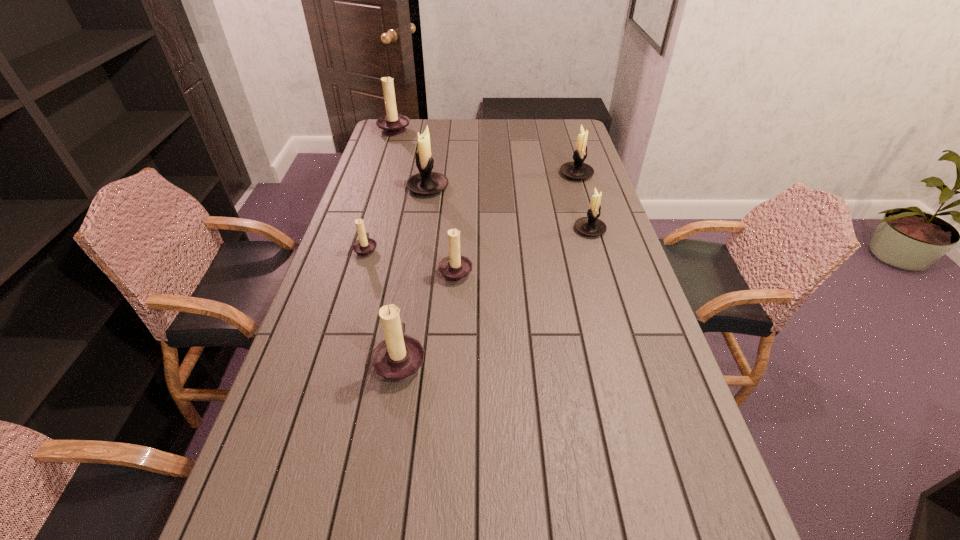
The image size is (960, 540). Find the location of `the biggest brown candle holder`. the biggest brown candle holder is located at coordinates click(393, 124).

Identify the location of the farthest brown candle holder. The width and height of the screenshot is (960, 540). (393, 124).

At what (x,y) coordinates should I click in order to perform the action: click on the biggest white candle holder. Please return your answer as a coordinate pair (x, y). This screenshot has height=540, width=960. Looking at the image, I should click on (426, 182).

Locate an element on the screen. the nearest object is located at coordinates (398, 358).

Find the location of a particular element. The width and height of the screenshot is (960, 540). the nearest brown candle holder is located at coordinates (398, 358).

The height and width of the screenshot is (540, 960). What are the coordinates of `the second biggest white candle holder` in the screenshot? It's located at (578, 170).

You are a GUI agent. You are given a task and a screenshot of the screen. Output one action in this format:
    pyautogui.click(x=<x>, y=<y>)
    Task: Click on the rightmost brown candle holder
    The width and height of the screenshot is (960, 540).
    Given the screenshot: What is the action you would take?
    pyautogui.click(x=455, y=268)

This screenshot has height=540, width=960. Identify the location of the smallest white candle holder. (590, 226).

Where is `the fourth farthest object`? The image size is (960, 540). the fourth farthest object is located at coordinates (590, 226).

Locate an element on the screen. The height and width of the screenshot is (540, 960). the smallest brown candle holder is located at coordinates (365, 246).